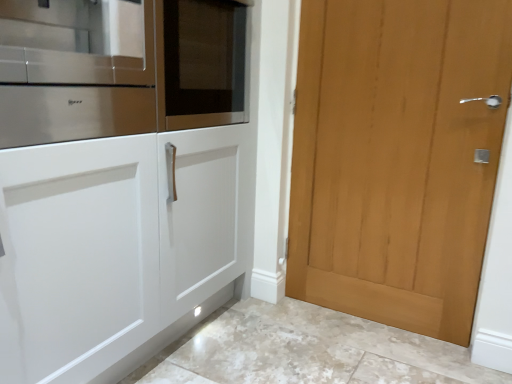
This screenshot has width=512, height=384. In order to click on space that is in front of light brown wood door at right in this screenshot , I will do `click(374, 354)`.